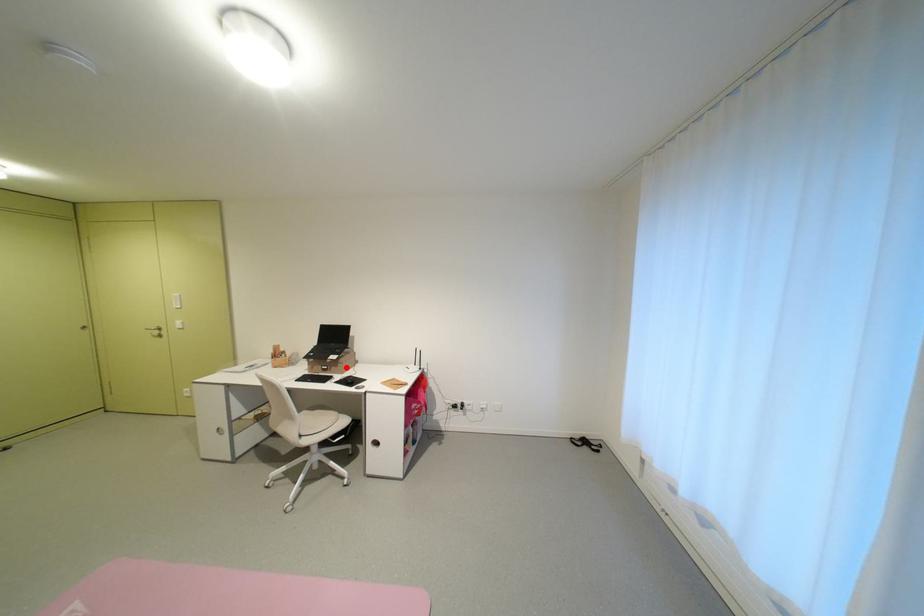
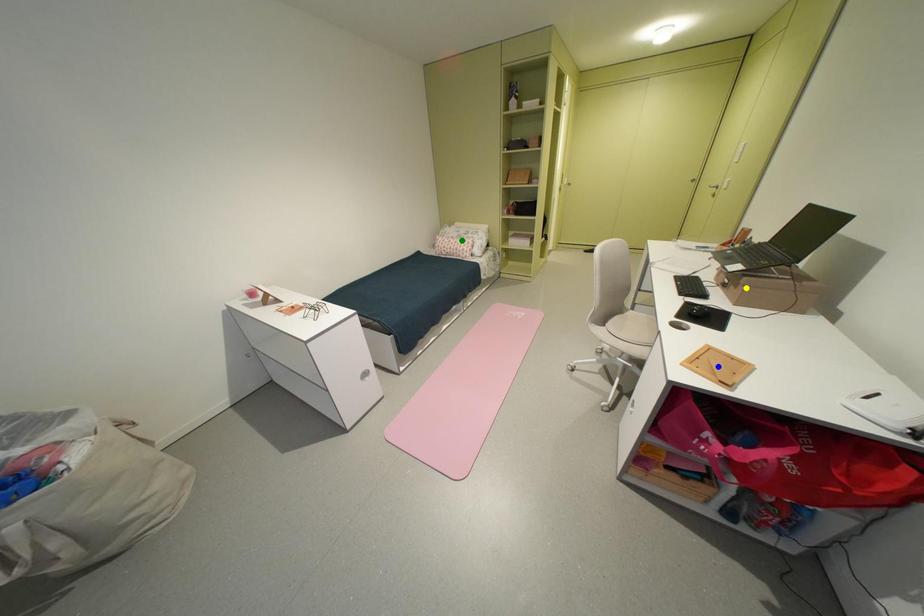
Question: I am providing you with two images of the same scene from different viewpoints. A red point is marked on the first image. You are given multiple points on the second image. Can you choose the point in image 2 that corresponds to the point in image 1?

Choices:
 (A) yellow point
 (B) green point
 (C) blue point

Answer: (A)